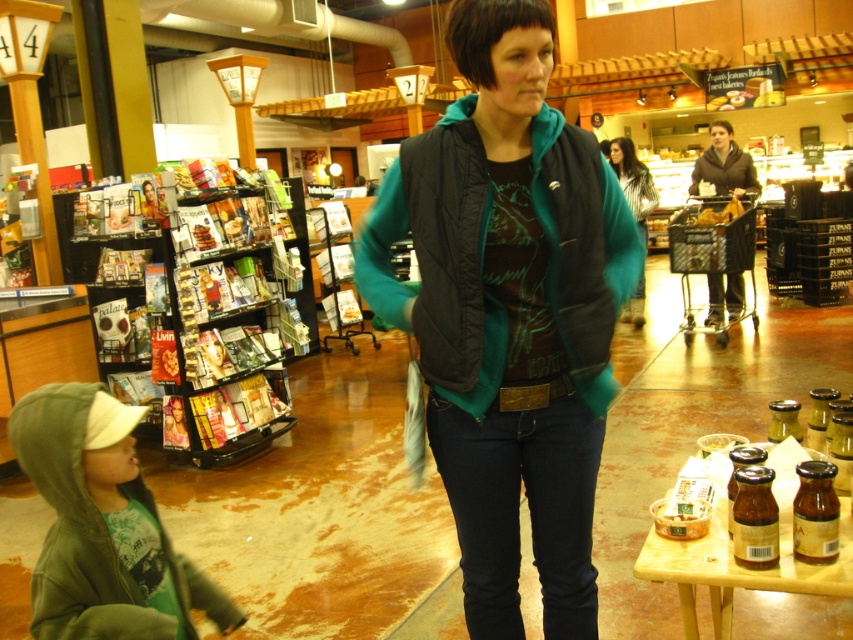
You are a customer in the grocery store and want to grab a magazine from the metallic magazine rack at left while talking to the woman in the black quilted vest at center. Can you reach the rack without moving away from the vest?

The black quilted vest at center is closer to the viewer than the metallic magazine rack at left, so you would need to move away from the vest to reach the rack.

You are a store employee who needs to find the black quilted vest at center and the green fleece hoodie at lower left. Based on the scene, which direction should you look first to locate both items?

The black quilted vest at center is to the right of green fleece hoodie at lower left. So to locate both items, you should first look towards the lower left where the green fleece hoodie at lower left is located, then shift your gaze to the right to find the black quilted vest at center.

You are a store employee who needs to reach an item on a shelf behind the black quilted vest at center. Can you move around the vest to access the shelf?

The black quilted vest at center is located at point (439, 259), which means it is positioned in the lower middle section of the frame. Since the vest is at the center, you can move around either side to access the shelf behind it.